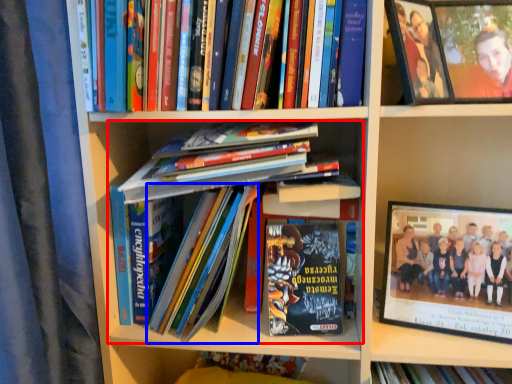
Question: Among these objects, which one is nearest to the camera, book (highlighted by a red box) or book (highlighted by a blue box)?

Choices:
 (A) book
 (B) book

Answer: (A)